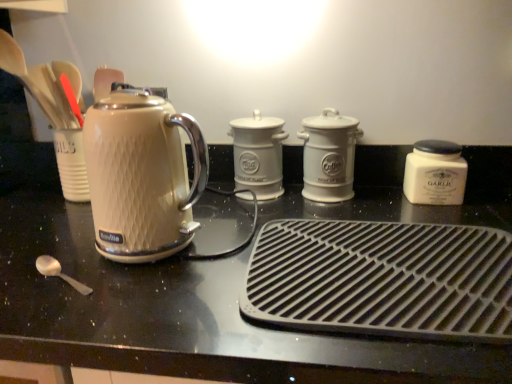
The width and height of the screenshot is (512, 384). In order to click on free space in front of matte cream kettle at left in this screenshot , I will do `click(141, 304)`.